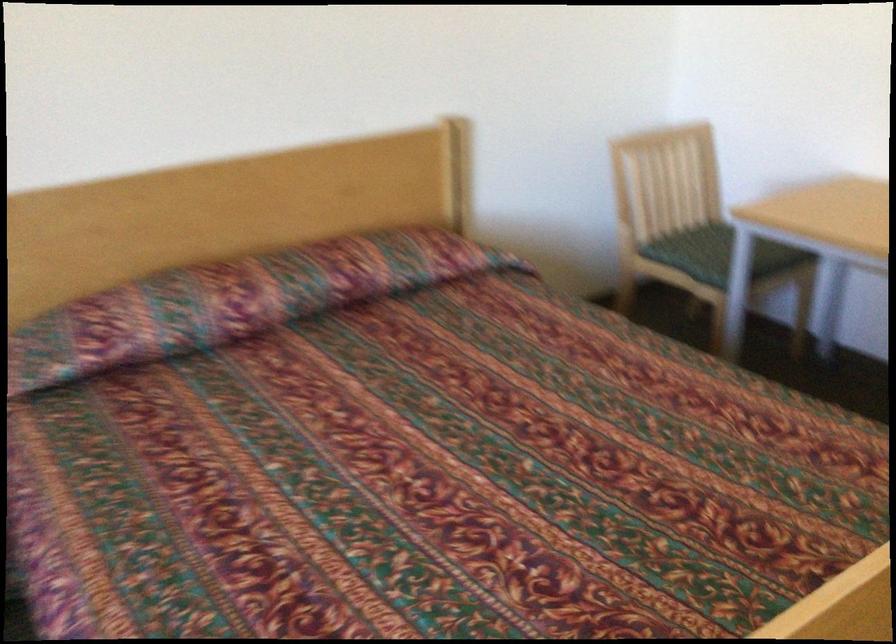
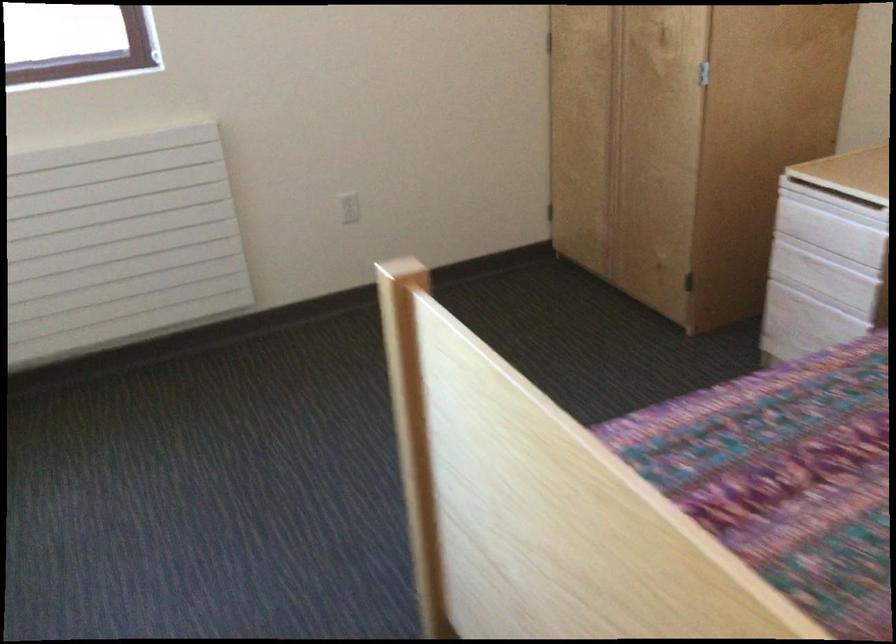
First-person continuous shooting, in which direction is the camera rotating?

The camera rotated toward left-down.